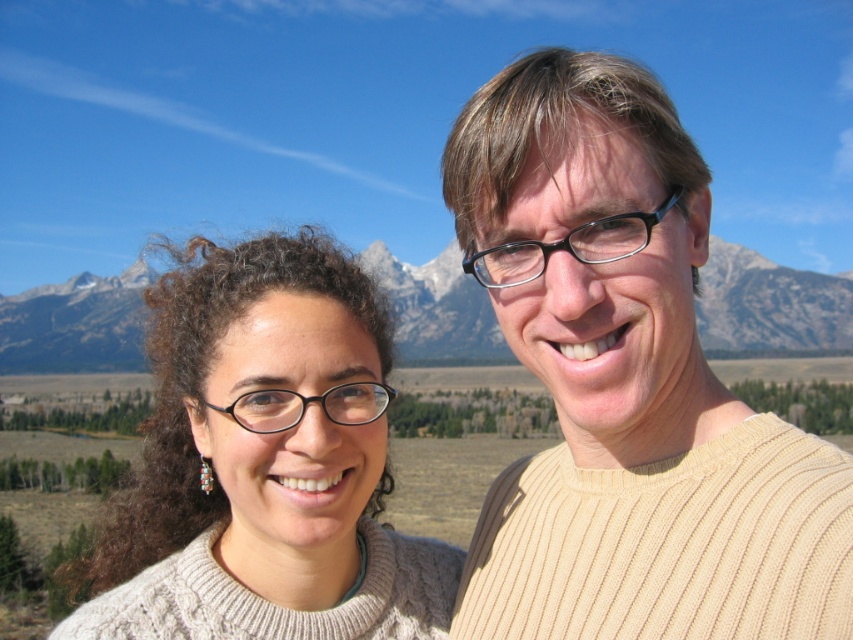
Between knitted sweater at center and snowy granite mountain at center, which one is positioned lower?

knitted sweater at center

At what (x,y) coordinates should I click in order to perform the action: click on knitted sweater at center. Please return your answer as a coordinate pair (x, y). Looking at the image, I should click on (265, 461).

Locate an element on the screen. The height and width of the screenshot is (640, 853). knitted sweater at center is located at coordinates (265, 461).